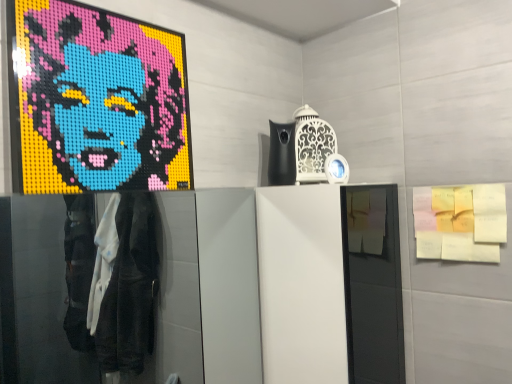
Question: Can you confirm if yellow sticky notes at upper right is positioned to the right of brick mosaic portrait at upper left?

Choices:
 (A) yes
 (B) no

Answer: (A)

Question: Does yellow sticky notes at upper right have a larger size compared to brick mosaic portrait at upper left?

Choices:
 (A) no
 (B) yes

Answer: (A)

Question: Are yellow sticky notes at upper right and brick mosaic portrait at upper left located far from each other?

Choices:
 (A) yes
 (B) no

Answer: (B)

Question: From the image's perspective, would you say yellow sticky notes at upper right is shown under brick mosaic portrait at upper left?

Choices:
 (A) yes
 (B) no

Answer: (A)

Question: Is yellow sticky notes at upper right positioned in front of brick mosaic portrait at upper left?

Choices:
 (A) no
 (B) yes

Answer: (A)

Question: Does yellow sticky notes at upper right lie behind brick mosaic portrait at upper left?

Choices:
 (A) yes
 (B) no

Answer: (A)

Question: Can you confirm if brick mosaic portrait at upper left is shorter than yellow sticky notes at upper right?

Choices:
 (A) yes
 (B) no

Answer: (B)

Question: Is the depth of brick mosaic portrait at upper left less than that of yellow sticky notes at upper right?

Choices:
 (A) no
 (B) yes

Answer: (B)

Question: Is brick mosaic portrait at upper left facing towards yellow sticky notes at upper right?

Choices:
 (A) yes
 (B) no

Answer: (B)

Question: Is brick mosaic portrait at upper left to the right of yellow sticky notes at upper right from the viewer's perspective?

Choices:
 (A) yes
 (B) no

Answer: (B)

Question: Is brick mosaic portrait at upper left directly adjacent to yellow sticky notes at upper right?

Choices:
 (A) no
 (B) yes

Answer: (A)

Question: Does brick mosaic portrait at upper left have a larger size compared to yellow sticky notes at upper right?

Choices:
 (A) no
 (B) yes

Answer: (B)

Question: From the image's perspective, is yellow sticky notes at upper right above or below brick mosaic portrait at upper left?

Choices:
 (A) above
 (B) below

Answer: (B)